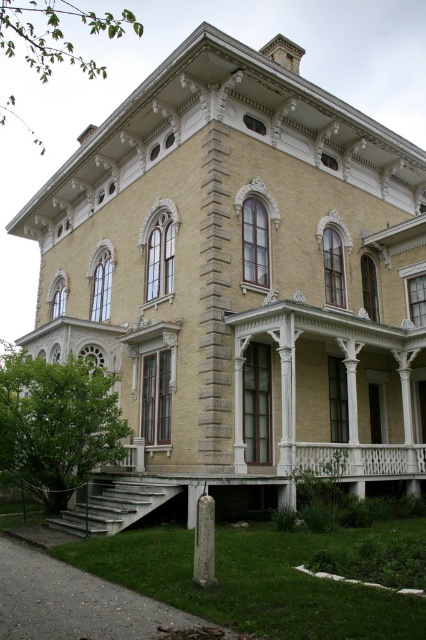
You are standing at the entrance of the grand Victorian house and want to locate the white painted wood porch at lower center. According to the coordinates provided, where exactly should you look to find it?

The white painted wood porch at lower center is located at coordinates point (160,497).

You are a painter standing at the base of the house and need to paint both the white wood balustrade at center and the white stone post at lower center. Which object will require you to reach higher to paint?

The white wood balustrade at center requires reaching higher because it has a greater height compared to the white stone post at lower center.

You are standing at the entrance of the Victorian house and see the white painted wood porch at lower center and the white stone post at lower center. Which object is closer to you?

The white painted wood porch at lower center is closer to you because the white stone post at lower center is behind it.